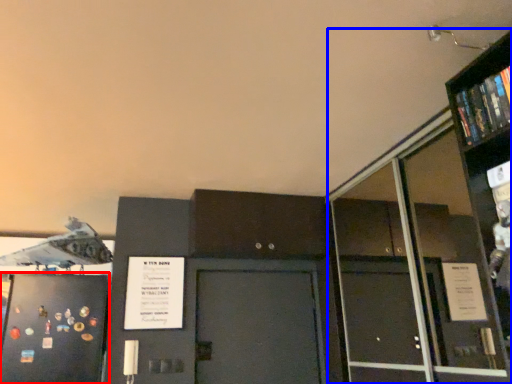
Question: Which of the following is the closest to the observer, door (highlighted by a red box) or bookcase (highlighted by a blue box)?

Choices:
 (A) door
 (B) bookcase

Answer: (B)